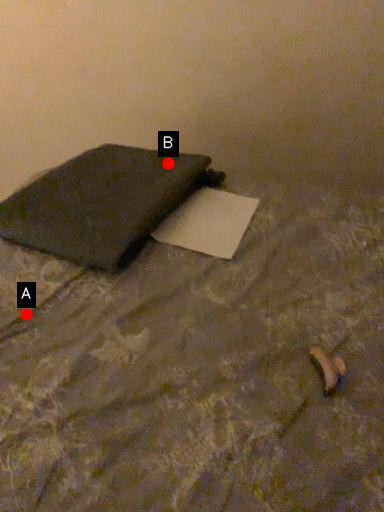
Question: Two points are circled on the image, labeled by A and B beside each circle. Which of the following is the closest to the observer?

Choices:
 (A) A is closer
 (B) B is closer

Answer: (A)